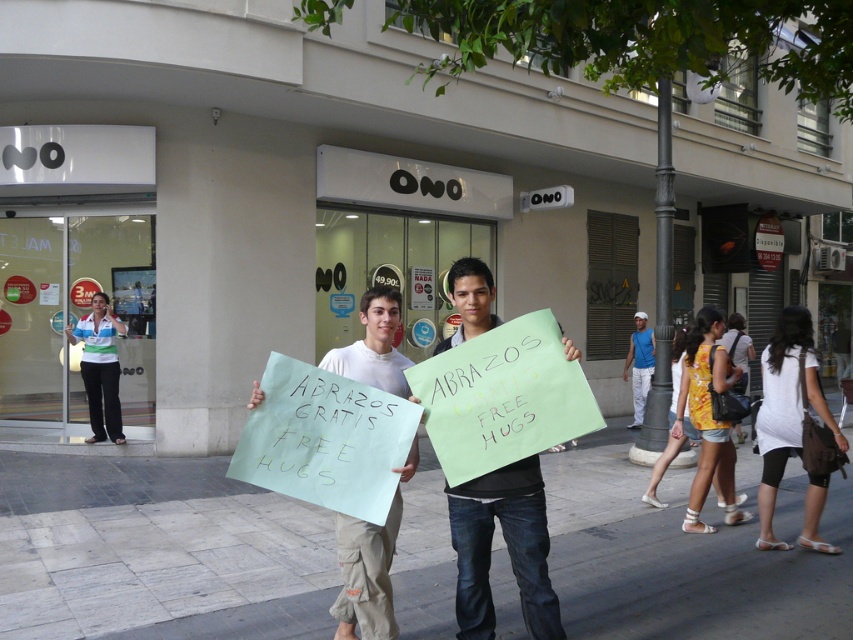
Question: Which object is positioned closest to the light blue paper sign at center?

Choices:
 (A) white fabric shirt at center
 (B) yellow floral dress at center
 (C) green paper sign at center

Answer: (C)

Question: Can you confirm if light blue paper sign at center is wider than blue fabric shirt at left?

Choices:
 (A) yes
 (B) no

Answer: (B)

Question: Among these objects, which one is farthest from the camera?

Choices:
 (A) white fabric shirt at center
 (B) blue fabric shirt at left

Answer: (B)

Question: Among these objects, which one is farthest from the camera?

Choices:
 (A) blue sleeveless shirt at right
 (B) blue fabric shirt at left
 (C) green paper sign at center
 (D) yellow floral dress at center

Answer: (A)

Question: Can you confirm if blue fabric shirt at left is wider than blue sleeveless shirt at right?

Choices:
 (A) no
 (B) yes

Answer: (B)

Question: Can you confirm if gray concrete pavement at center is thinner than blue sleeveless shirt at right?

Choices:
 (A) no
 (B) yes

Answer: (A)